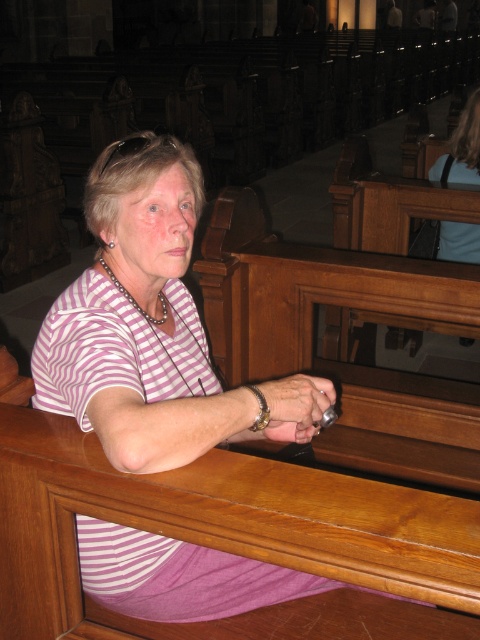
You are standing in the church and notice two shirts in the scene. The pink striped shirt at center and the blue fabric shirt at upper center. Which one is positioned higher up in the image?

The blue fabric shirt at upper center is positioned higher up in the image compared to the pink striped shirt at center.

You are standing in the church and want to locate the blue fabric shirt at upper center. According to the coordinates provided, where would you look in the image?

The blue fabric shirt at upper center is located at the coordinates point (462, 148) in the image.

You are standing in the church and see the pink striped shirt at center and the blue fabric shirt at upper center. Which one is nearer to you?

The pink striped shirt at center is closer to the viewer than the blue fabric shirt at upper center.